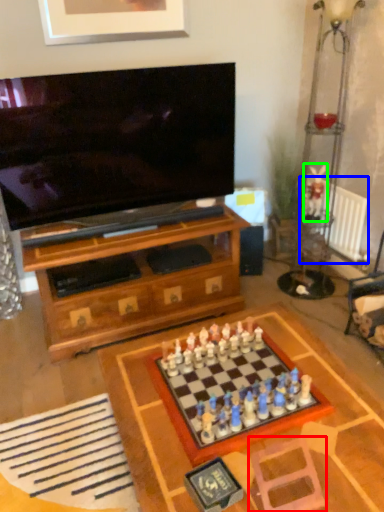
Question: Based on their relative distances, which object is farther from swivel chair (highlighted by a red box)? Choose from radiator (highlighted by a blue box) and toy (highlighted by a green box).

Choices:
 (A) radiator
 (B) toy

Answer: (B)